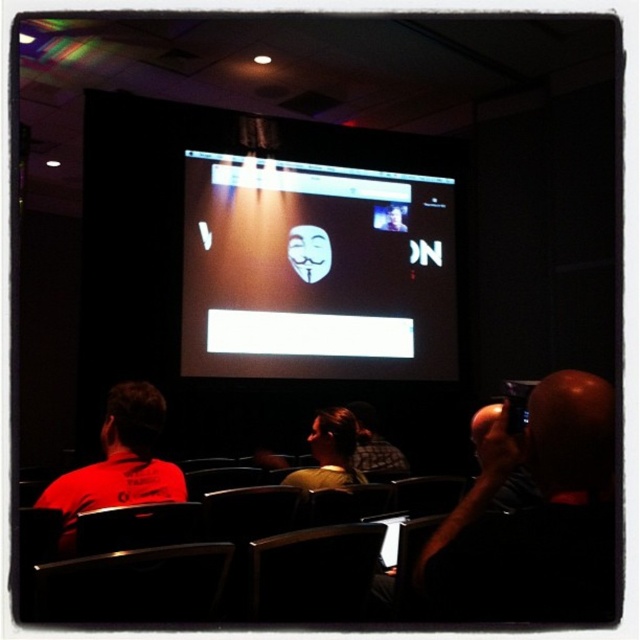
Is bald head camera at right to the left of white matte mask at center from the viewer's perspective?

Incorrect, bald head camera at right is not on the left side of white matte mask at center.

Does bald head camera at right lie behind white matte mask at center?

That is False.

Which is in front, point (444, 600) or point (316, 246)?

Point (444, 600) is in front.

The height and width of the screenshot is (640, 640). Find the location of `bald head camera at right`. bald head camera at right is located at coordinates (532, 515).

Measure the distance from matte black mask at center to red matte shirt at left.

matte black mask at center is 3.67 meters away from red matte shirt at left.

Is matte black mask at center positioned in front of red matte shirt at left?

No, it is not.

Does point (291, 269) lie in front of point (152, 448)?

No.

Where is `matte black mask at center`? matte black mask at center is located at coordinates (323, 278).

Which of these two, matte black mask at center or white matte mask at center, stands shorter?

white matte mask at center is shorter.

Is point (188, 196) behind point (289, 252)?

No.

Is point (198, 308) in front of point (310, 234)?

Yes, it is.

Where is `matte black mask at center`? matte black mask at center is located at coordinates (323, 278).